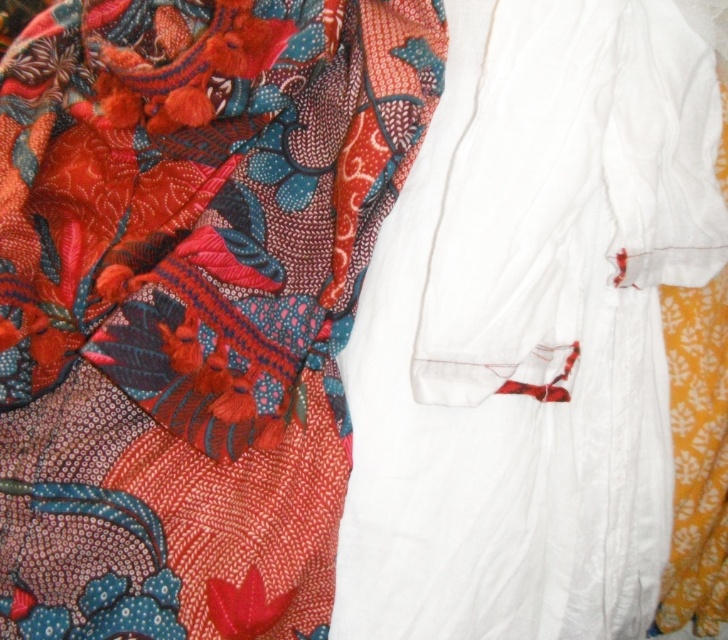
Question: Can you confirm if white cotton robe at center is bigger than floral silk scarf at upper left?

Choices:
 (A) yes
 (B) no

Answer: (A)

Question: Among these points, which one is nearest to the camera?

Choices:
 (A) (448, 204)
 (B) (47, 180)

Answer: (A)

Question: Among these objects, which one is nearest to the camera?

Choices:
 (A) floral silk scarf at upper left
 (B) white cotton robe at center

Answer: (B)

Question: Is white cotton robe at center bigger than floral silk scarf at upper left?

Choices:
 (A) no
 (B) yes

Answer: (B)

Question: Does white cotton robe at center appear under floral silk scarf at upper left?

Choices:
 (A) yes
 (B) no

Answer: (A)